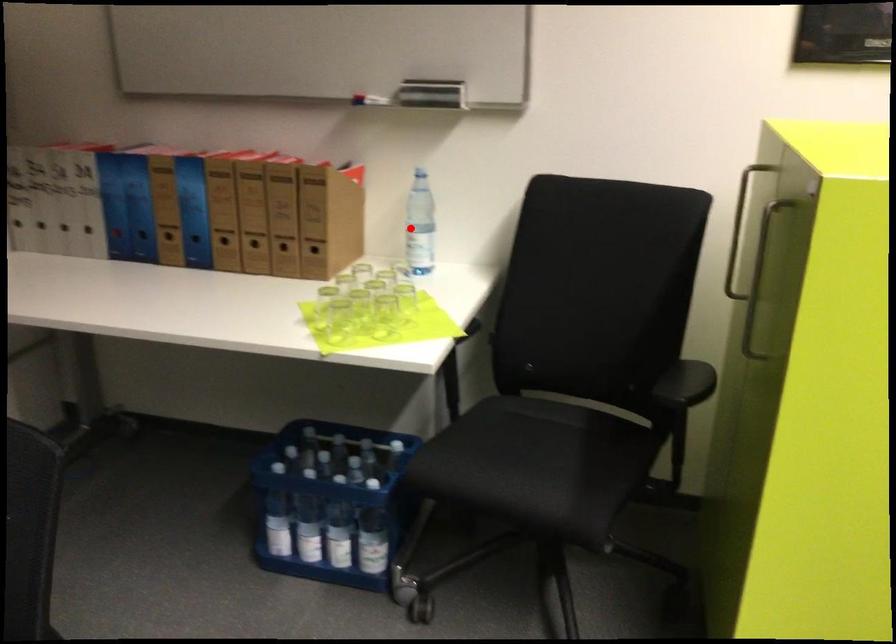
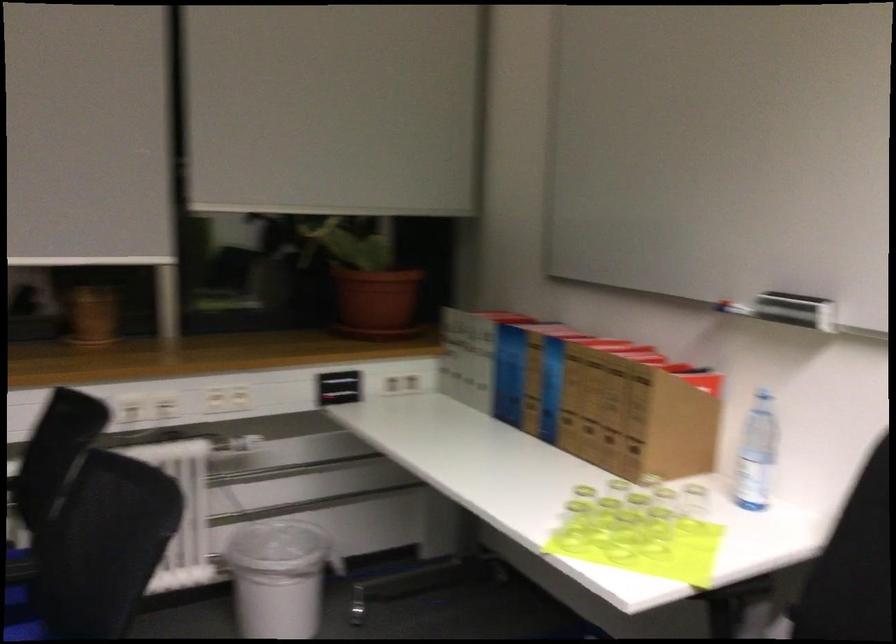
Question: I am providing you with two images of the same scene from different viewpoints. Image1 has a red point marked. In image2, the corresponding 3D location appears at what relative position? Reply with the corresponding letter.

Choices:
 (A) Closer
 (B) Farther

Answer: (A)